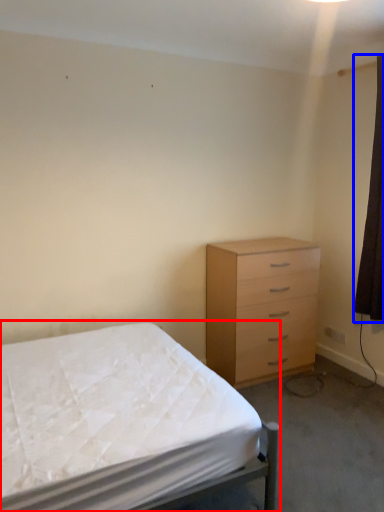
Question: Which point is closer to the camera, bed (highlighted by a red box) or curtain (highlighted by a blue box)?

Choices:
 (A) bed
 (B) curtain

Answer: (A)